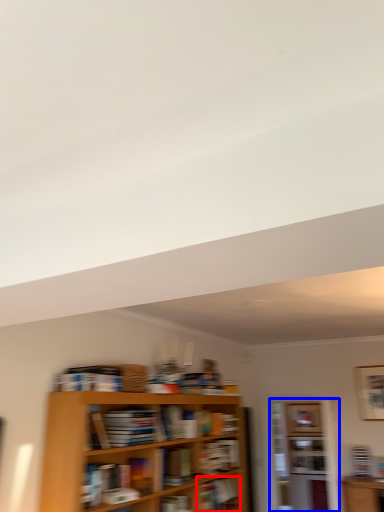
Question: Which object appears closest to the camera in this image, book (highlighted by a red box) or shelf (highlighted by a blue box)?

Choices:
 (A) book
 (B) shelf

Answer: (A)